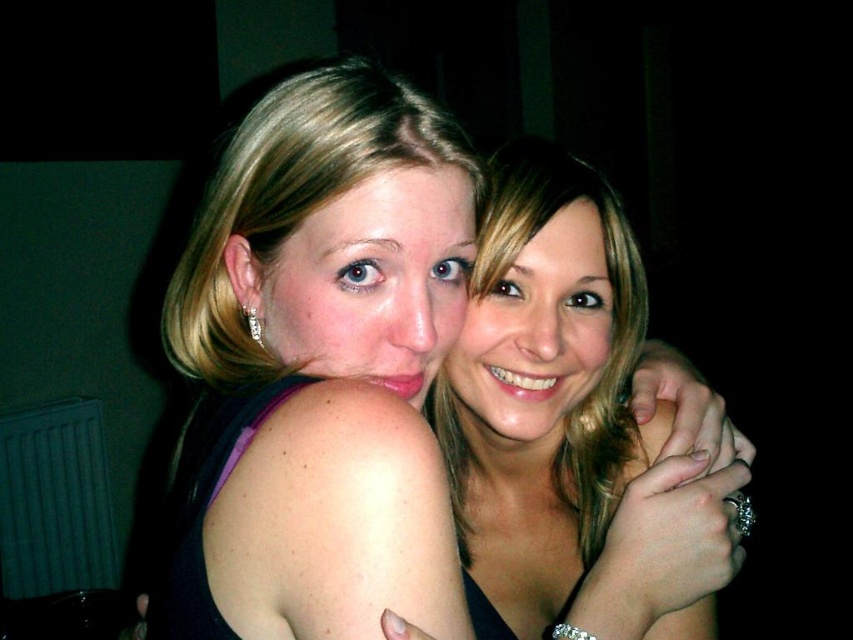
Question: Which point is farther from the camera taking this photo?

Choices:
 (A) (706, 554)
 (B) (224, 515)

Answer: (A)

Question: Among these points, which one is nearest to the camera?

Choices:
 (A) (x=515, y=269)
 (B) (x=250, y=182)

Answer: (B)

Question: Can you confirm if matte black dress at center is positioned above smooth skin face at center?

Choices:
 (A) yes
 (B) no

Answer: (A)

Question: Can you confirm if matte black dress at center is thinner than smooth skin face at center?

Choices:
 (A) yes
 (B) no

Answer: (B)

Question: Is matte black dress at center positioned at the back of smooth skin face at center?

Choices:
 (A) yes
 (B) no

Answer: (B)